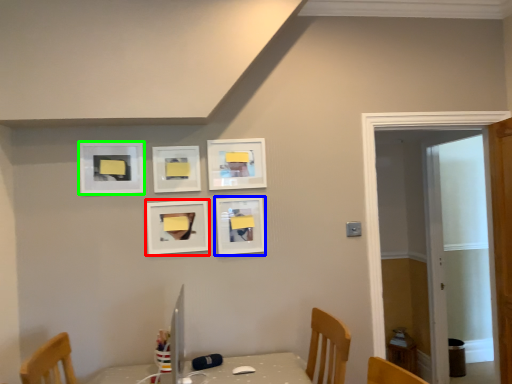
Question: Which is farther away from picture frame (highlighted by a red box)? picture frame (highlighted by a blue box) or picture frame (highlighted by a green box)?

Choices:
 (A) picture frame
 (B) picture frame

Answer: (B)